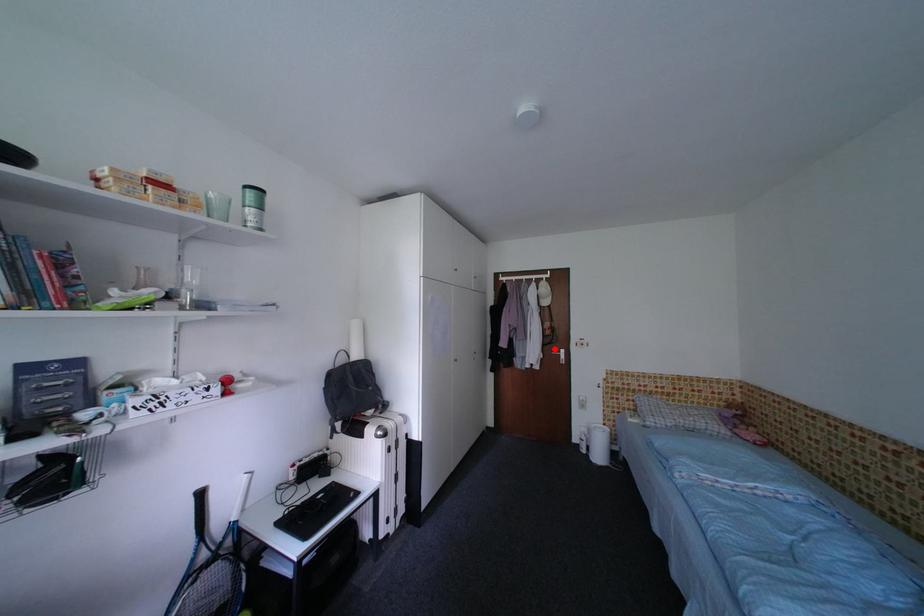
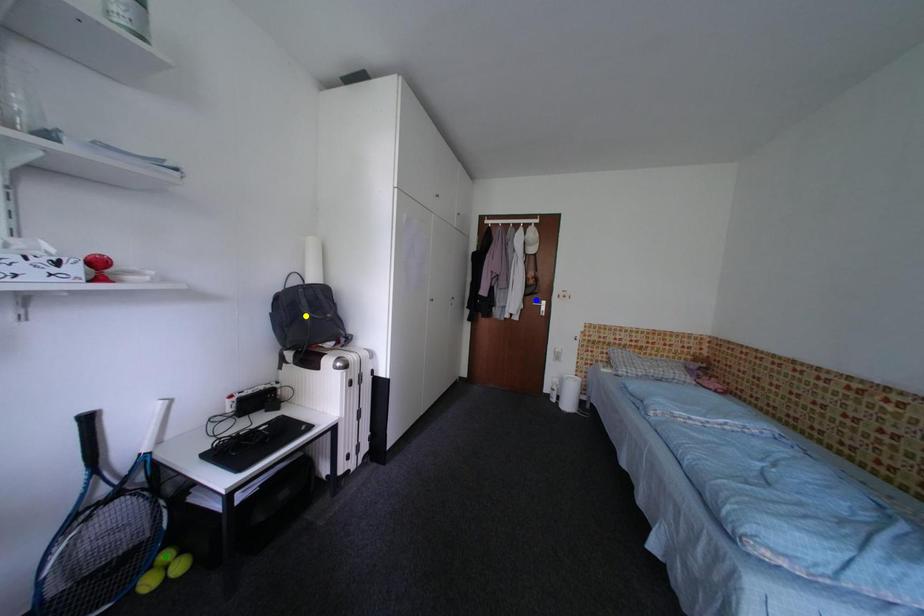
Question: I am providing you with two images of the same scene from different viewpoints. A red point is marked on the first image. You are given multiple points on the second image. Can you choose the point in image 2 that corresponds to the point in image 1?

Choices:
 (A) blue point
 (B) yellow point
 (C) green point

Answer: (A)